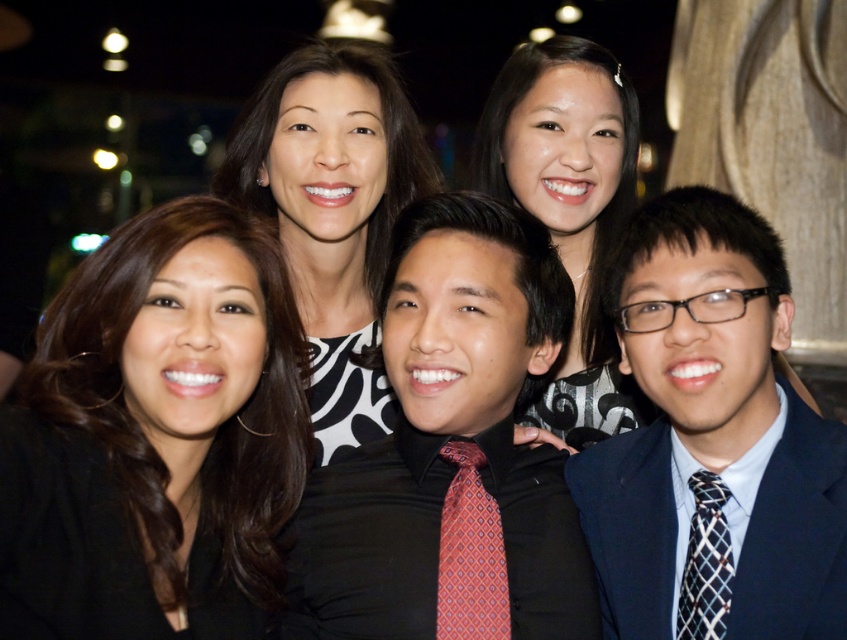
Who is more forward, [590,221] or [696,637]?

Point [696,637] is in front.

Is point (623, 424) closer to camera compared to point (707, 589)?

No, (623, 424) is further to viewer.

Does point (595, 397) come behind point (728, 614)?

That is True.

Where is `matte black dress at upper center`? The height and width of the screenshot is (640, 847). matte black dress at upper center is located at coordinates (568, 211).

Which is more to the left, red silk tie at center or black checkered tie at right?

Positioned to the left is red silk tie at center.

Does point (475, 588) come behind point (685, 582)?

That is True.

You are a GUI agent. You are given a task and a screenshot of the screen. Output one action in this format:
    pyautogui.click(x=<x>, y=<y>)
    Task: Click on the red silk tie at center
    This screenshot has height=640, width=847.
    Given the screenshot: What is the action you would take?
    pyautogui.click(x=469, y=554)

Which is behind, point (358, 556) or point (612, 488)?

The point (612, 488) is more distant.

How much distance is there between black satin shirt at center and navy blue suit at center?

black satin shirt at center is 4.05 meters from navy blue suit at center.

Who is more distant from viewer, (443, 385) or (795, 499)?

Positioned behind is point (443, 385).

Identify the location of black satin shirt at center. The width and height of the screenshot is (847, 640). (451, 449).